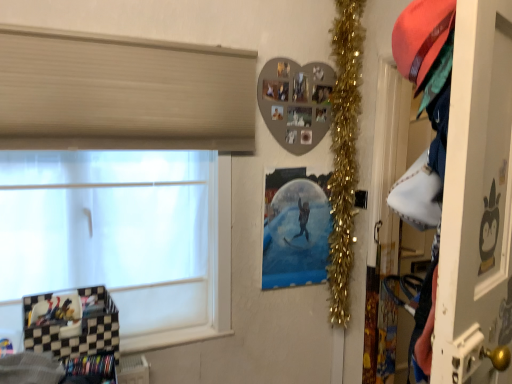
What is the approximate height of gold tinsel garland at upper right?

gold tinsel garland at upper right is 5.45 feet tall.

Find the location of a particular element. The image size is (512, 384). white matte window at left is located at coordinates (122, 93).

Considering the relative sizes of metallic silver poster at center and white matte window at left in the image provided, is metallic silver poster at center taller than white matte window at left?

No.

Which point is more distant from viewer, (297, 274) or (108, 84)?

The point (297, 274) is farther from the camera.

Looking at the image, does metallic silver poster at center seem bigger or smaller compared to white matte window at left?

metallic silver poster at center is smaller than white matte window at left.

How different are the orientations of metallic silver poster at center and white matte window at left in degrees?

1.31 degrees.

Is gold tinsel garland at upper right shorter than metallic silver poster at center?

Incorrect, the height of gold tinsel garland at upper right does not fall short of that of metallic silver poster at center.

Which object is more forward, gold tinsel garland at upper right or metallic silver poster at center?

gold tinsel garland at upper right is more forward.

What are the coordinates of `christmas decoration above the metallic silver poster at center (from a real-world perspective)` in the screenshot? It's located at (344, 151).

Can you confirm if metallic silver poster at center is shorter than white glossy screen door at right?

Yes, metallic silver poster at center is shorter than white glossy screen door at right.

Is point (304, 174) closer to viewer compared to point (509, 277)?

No.

From the image's perspective, does metallic silver poster at center appear higher than white glossy screen door at right?

No.

Where is `picture frame behind the white glossy screen door at right`? The height and width of the screenshot is (384, 512). picture frame behind the white glossy screen door at right is located at coordinates (295, 228).

Is gold tinsel garland at upper right positioned with its back to white glossy screen door at right?

No, gold tinsel garland at upper right is not facing away from white glossy screen door at right.

Which point is more forward, (337, 299) or (464, 273)?

The point (464, 273) is closer.

Measure the distance between gold tinsel garland at upper right and white glossy screen door at right.

gold tinsel garland at upper right and white glossy screen door at right are 1.25 meters apart.

Is gold tinsel garland at upper right beside white glossy screen door at right?

There is a gap between gold tinsel garland at upper right and white glossy screen door at right.

Where is `christmas decoration above the white matte window at left (from a real-world perspective)`? Image resolution: width=512 pixels, height=384 pixels. christmas decoration above the white matte window at left (from a real-world perspective) is located at coordinates (344, 151).

Is white matte window at left inside or outside of gold tinsel garland at upper right?

white matte window at left is not inside gold tinsel garland at upper right, it's outside.

Is white matte window at left oriented away from gold tinsel garland at upper right?

No, white matte window at left is not facing the opposite direction of gold tinsel garland at upper right.

Considering the sizes of objects white matte window at left and gold tinsel garland at upper right in the image provided, who is thinner, white matte window at left or gold tinsel garland at upper right?

With smaller width is white matte window at left.

Which object is thinner, gold tinsel garland at upper right or white matte window at left?

Thinner between the two is white matte window at left.

From the image's perspective, is gold tinsel garland at upper right above white matte window at left?

Yes, from the image's perspective, gold tinsel garland at upper right is on top of white matte window at left.

How different are the orientations of gold tinsel garland at upper right and white matte window at left in degrees?

There is a 0.118-degree angle between the facing directions of gold tinsel garland at upper right and white matte window at left.

Measure the distance between gold tinsel garland at upper right and white matte window at left.

The distance of gold tinsel garland at upper right from white matte window at left is 32.53 inches.

Considering the relative sizes of white matte window at left and metallic silver poster at center in the image provided, is white matte window at left smaller than metallic silver poster at center?

Actually, white matte window at left might be larger than metallic silver poster at center.

Between point (200, 143) and point (295, 280), which one is positioned in front?

Positioned in front is point (200, 143).

Can you tell me how much white matte window at left and metallic silver poster at center differ in facing direction?

They differ by 1.31 degrees in their facing directions.

Is white matte window at left closer to camera compared to metallic silver poster at center?

Yes, white matte window at left is closer to the camera.

Locate an element on the screen. The height and width of the screenshot is (384, 512). picture frame behind the white matte window at left is located at coordinates (295, 228).

This screenshot has width=512, height=384. In order to click on picture frame that appears below the gold tinsel garland at upper right (from a real-world perspective) in this screenshot , I will do (x=295, y=228).

When comparing their distances from white matte window at left, does white glossy screen door at right or gold tinsel garland at upper right seem further?

white glossy screen door at right.

Looking at the image, which one is located further to white matte window at left, metallic silver poster at center or white glossy screen door at right?

The object further to white matte window at left is white glossy screen door at right.

Estimate the real-world distances between objects in this image. Which object is closer to metallic silver poster at center, gold tinsel garland at upper right or white glossy screen door at right?

Among the two, gold tinsel garland at upper right is located nearer to metallic silver poster at center.

Based on their spatial positions, is white glossy screen door at right or white matte window at left closer to gold tinsel garland at upper right?

white matte window at left is positioned closer to the anchor gold tinsel garland at upper right.

Considering their positions, is white matte window at left positioned further to gold tinsel garland at upper right than white glossy screen door at right?

The object further to gold tinsel garland at upper right is white glossy screen door at right.

Looking at the image, which one is located closer to gold tinsel garland at upper right, white matte window at left or metallic silver poster at center?

metallic silver poster at center.

Considering their positions, is gold tinsel garland at upper right positioned closer to white matte window at left than white glossy screen door at right?

The object closer to white matte window at left is gold tinsel garland at upper right.

Estimate the real-world distances between objects in this image. Which object is further from metallic silver poster at center, white glossy screen door at right or gold tinsel garland at upper right?

The object further to metallic silver poster at center is white glossy screen door at right.

Find the location of a particular element. This screenshot has height=384, width=512. christmas decoration located between white glossy screen door at right and metallic silver poster at center in the depth direction is located at coordinates (344, 151).

The height and width of the screenshot is (384, 512). Identify the location of window between white glossy screen door at right and gold tinsel garland at upper right along the z-axis. (122, 93).

You are a GUI agent. You are given a task and a screenshot of the screen. Output one action in this format:
    pyautogui.click(x=<x>, y=<y>)
    Task: Click on the picture frame between white matte window at left and gold tinsel garland at upper right from left to right
    This screenshot has height=384, width=512.
    Given the screenshot: What is the action you would take?
    pyautogui.click(x=295, y=228)

Find the location of `window positioned between white glossy screen door at right and metallic silver poster at center from near to far`. window positioned between white glossy screen door at right and metallic silver poster at center from near to far is located at coordinates (122, 93).